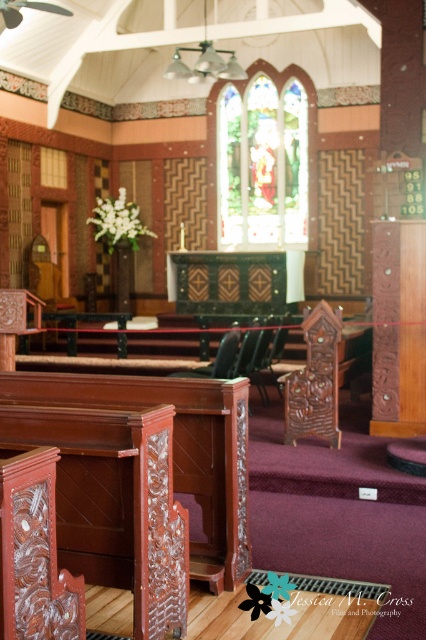
From the picture: Is stained glass at center further to the viewer compared to wooden carved chair at center?

Yes, it is behind wooden carved chair at center.

Who is taller, stained glass at center or wooden carved chair at center?

Standing taller between the two is stained glass at center.

The height and width of the screenshot is (640, 426). What do you see at coordinates (261, 164) in the screenshot?
I see `stained glass at center` at bounding box center [261, 164].

The height and width of the screenshot is (640, 426). Identify the location of stained glass at center. (261, 164).